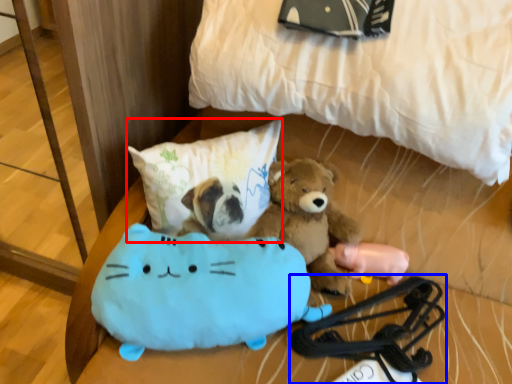
Question: Among these objects, which one is farthest to the camera, pillow (highlighted by a red box) or equipment (highlighted by a blue box)?

Choices:
 (A) pillow
 (B) equipment

Answer: (B)